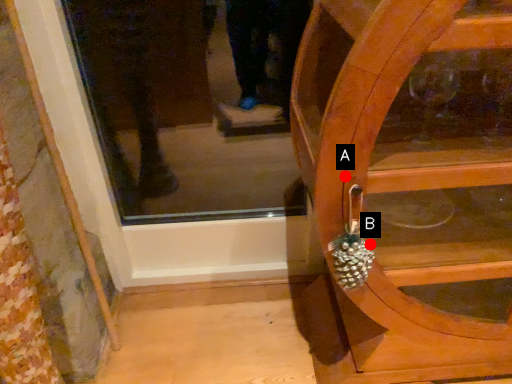
Question: Two points are circled on the image, labeled by A and B beside each circle. Which point appears closest to the camera in this image?

Choices:
 (A) A is closer
 (B) B is closer

Answer: (A)